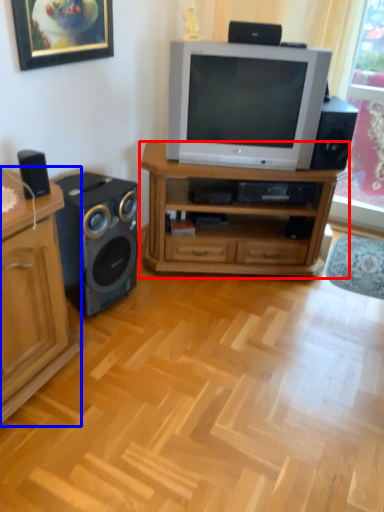
Question: Which object appears farthest to the camera in this image, desk (highlighted by a red box) or cabinetry (highlighted by a blue box)?

Choices:
 (A) desk
 (B) cabinetry

Answer: (A)